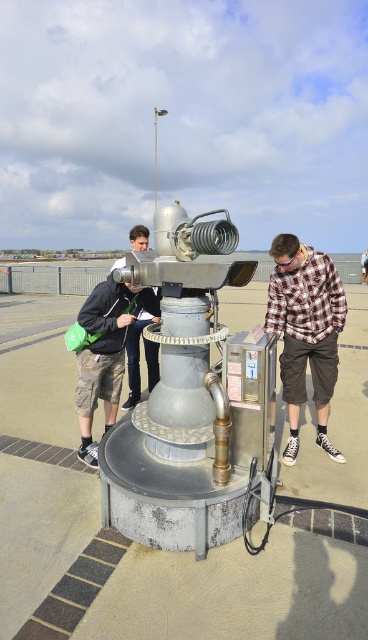
You are a photographer trying to capture a group photo of the plaid shirt at center and the matte black jacket at left. Since you want everyone to be in the frame, which person should you position to your left to ensure both are included?

The matte black jacket at left should be positioned to your left because the plaid shirt at center is on the right side of the matte black jacket at left, so placing the matte black jacket at left on your left side will keep both within the frame.

You are standing at the point marked by the coordinates point (306,332). Looking around, you see a person in a plaid shirt at center and a person in a black jacket and cargo shorts leaning over the structure. Which person is closer to your current position?

The person in a plaid shirt at center is located exactly at the point (306,332), so they are at your current position. The person in a black jacket and cargo shorts leaning over the structure is farther away from this point.